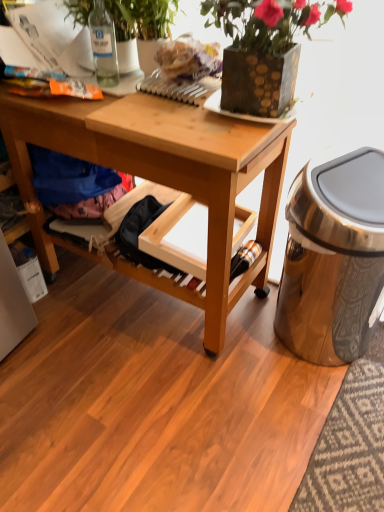
Question: Is blue fabric at lower left in front of or behind wooden drawer at center in the image?

Choices:
 (A) behind
 (B) front

Answer: (A)

Question: From the image's perspective, is blue fabric at lower left positioned above or below wooden drawer at center?

Choices:
 (A) below
 (B) above

Answer: (B)

Question: Estimate the real-world distances between objects in this image. Which object is farther from the textured brown vase at upper center, the first houseplant in the right-to-left sequence?

Choices:
 (A) blue fabric at lower left
 (B) clear glass bottle at upper left
 (C) green leafy plant at upper center, the 1th houseplant positioned from the left
 (D) wooden desk at center
 (E) matte plastic bag at upper center

Answer: (A)

Question: Based on their relative distances, which object is farther from the matte plastic bag at upper center?

Choices:
 (A) wooden drawer at center
 (B) green leafy plant at upper center, the 1th houseplant positioned from the left
 (C) polished metallic trash can at right
 (D) blue fabric at lower left
 (E) clear glass bottle at upper left

Answer: (C)